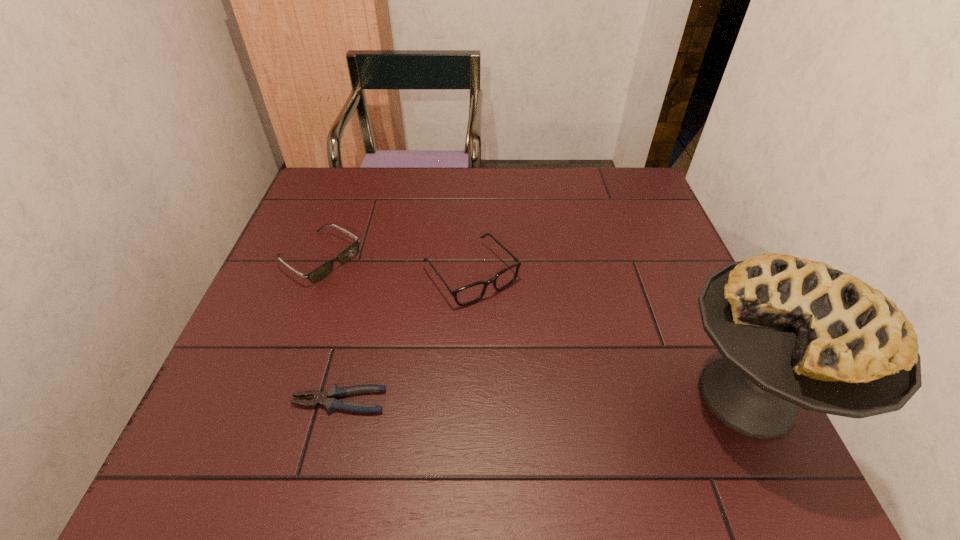
Find the location of `vacant space located on the cut side of the tallest object`. vacant space located on the cut side of the tallest object is located at coordinates (553, 397).

The height and width of the screenshot is (540, 960). I want to click on vacant region located on the front-facing side of the third tallest object, so click(x=451, y=343).

Identify the location of vacant space positioned on the front-facing side of the third tallest object. Image resolution: width=960 pixels, height=540 pixels. tap(372, 292).

Identify the location of vacant space located on the front-facing side of the third tallest object. click(473, 357).

Where is `free spot located on the front-facing side of the third object from left to right`? This screenshot has width=960, height=540. free spot located on the front-facing side of the third object from left to right is located at coordinates (537, 349).

This screenshot has width=960, height=540. Identify the location of free location located on the front-facing side of the third object from left to right. (571, 387).

This screenshot has height=540, width=960. What are the coordinates of `free space located 0.250m on the front-facing side of the third object from left to right` in the screenshot? It's located at (567, 383).

Locate an element on the screen. The height and width of the screenshot is (540, 960). pliers present at the near edge is located at coordinates (328, 399).

Where is `pie present at the near edge`? The width and height of the screenshot is (960, 540). pie present at the near edge is located at coordinates coord(792,332).

Image resolution: width=960 pixels, height=540 pixels. What are the coordinates of `pliers present at the left edge` in the screenshot? It's located at (328, 399).